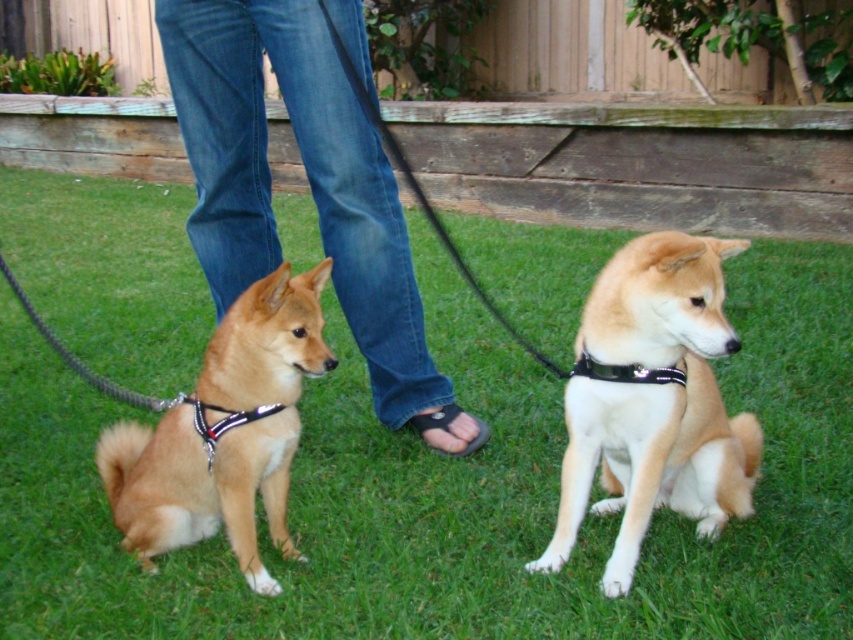
Can you confirm if green grass at lower center is positioned to the left of black leather collar at center?

Yes, green grass at lower center is to the left of black leather collar at center.

Find the location of a particular element. The height and width of the screenshot is (640, 853). green grass at lower center is located at coordinates (456, 492).

Is green grass at lower center to the left of golden fur dog at left from the viewer's perspective?

Incorrect, green grass at lower center is not on the left side of golden fur dog at left.

You are a GUI agent. You are given a task and a screenshot of the screen. Output one action in this format:
    pyautogui.click(x=<x>, y=<y>)
    Task: Click on the green grass at lower center
    
    Given the screenshot: What is the action you would take?
    pyautogui.click(x=456, y=492)

Is green grass at lower center positioned at the back of light brown fur at right?

That is True.

At what (x,y) coordinates should I click in order to perform the action: click on green grass at lower center. Please return your answer as a coordinate pair (x, y). Looking at the image, I should click on (456, 492).